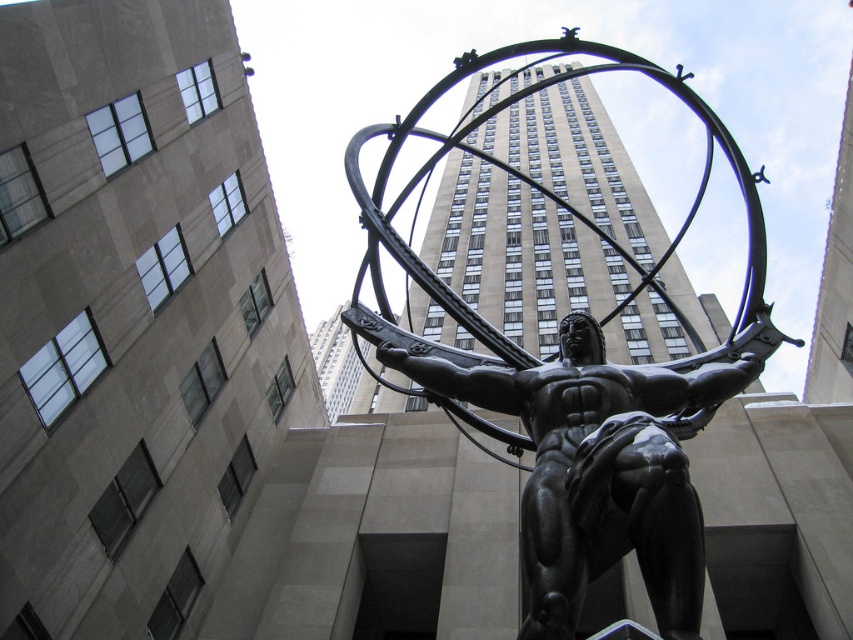
Which of these two, bronze statue at center or black polished statue at center, stands shorter?

black polished statue at center

The height and width of the screenshot is (640, 853). What do you see at coordinates (575, 381) in the screenshot? I see `bronze statue at center` at bounding box center [575, 381].

Is point (590, 460) positioned in front of point (607, 378)?

Yes, it is in front of point (607, 378).

Locate an element on the screen. bronze statue at center is located at coordinates (575, 381).